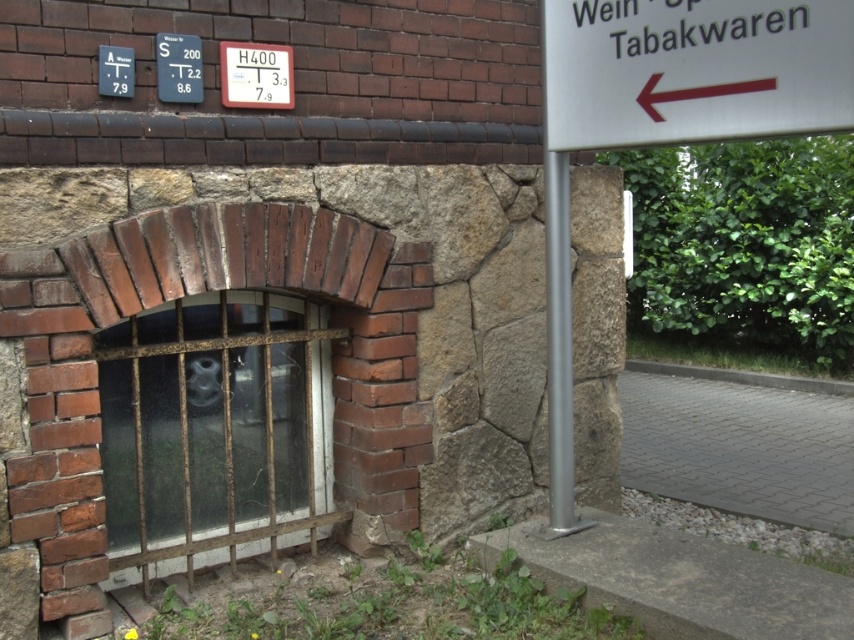
You are a delivery person trying to read the sign on the building. The rusty metal bars at center and the white plastic sign at upper center are in your line of sight. Which object is closer to the left side of your view?

The rusty metal bars at center is positioned on the left side of white plastic sign at upper center, so the rusty metal bars at center is closer to the left side of your view.

You are a delivery person trying to read two signs on a building wall. The signs are the white plastic sign at upper right and the white plastic sign at upper left. If your arms can reach up to 6 feet, can you touch both signs at the same time?

The white plastic sign at upper right and white plastic sign at upper left are 6.44 feet apart. Since your arms can only reach up to 6 feet, you cannot touch both signs at the same time.

Based on the photo, you are standing in front of the building and notice two points marked on the wall. The first point is at coordinate (770, 26) and the second at (115, 84). Based on the building structure described, which point is closer to you?

Point (770, 26) is in front of point (115, 84), so it is closer to you.